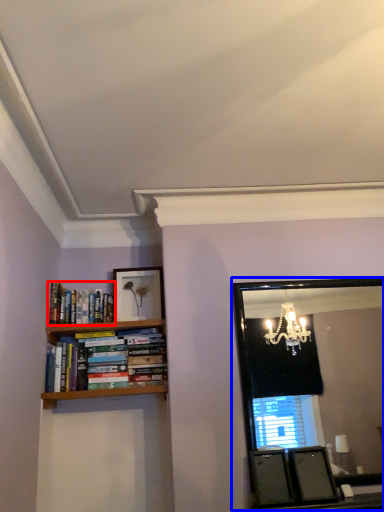
Question: Which point is closer to the camera, book (highlighted by a red box) or mirror (highlighted by a blue box)?

Choices:
 (A) book
 (B) mirror

Answer: (B)